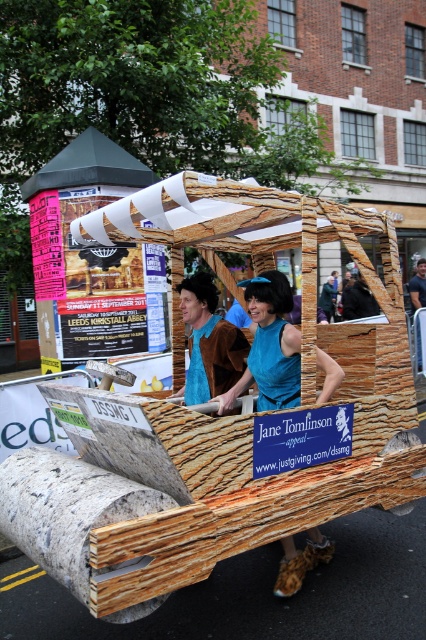
Who is positioned more to the left, teal fabric dress at center or blue fabric at center?

blue fabric at center is more to the left.

Can you confirm if teal fabric dress at center is positioned to the left of blue fabric at center?

In fact, teal fabric dress at center is to the right of blue fabric at center.

This screenshot has width=426, height=640. Find the location of `teal fabric dress at center`. teal fabric dress at center is located at coordinates (270, 346).

Who is lower down, blue fabric at center or brown leather jacket at center?

blue fabric at center is lower down.

Image resolution: width=426 pixels, height=640 pixels. What are the coordinates of `blue fabric at center` in the screenshot? It's located at (209, 340).

Does point (204, 390) come closer to viewer compared to point (422, 282)?

Yes.

What are the coordinates of `blue fabric at center` in the screenshot? It's located at (209, 340).

In the scene shown: Who is more forward, (80, 515) or (288, 561)?

Positioned in front is point (80, 515).

Which is behind, point (115, 412) or point (314, 552)?

The point (314, 552) is more distant.

The image size is (426, 640). Identify the location of wooden cart at center. (213, 420).

Locate an element on the screen. wooden cart at center is located at coordinates (213, 420).